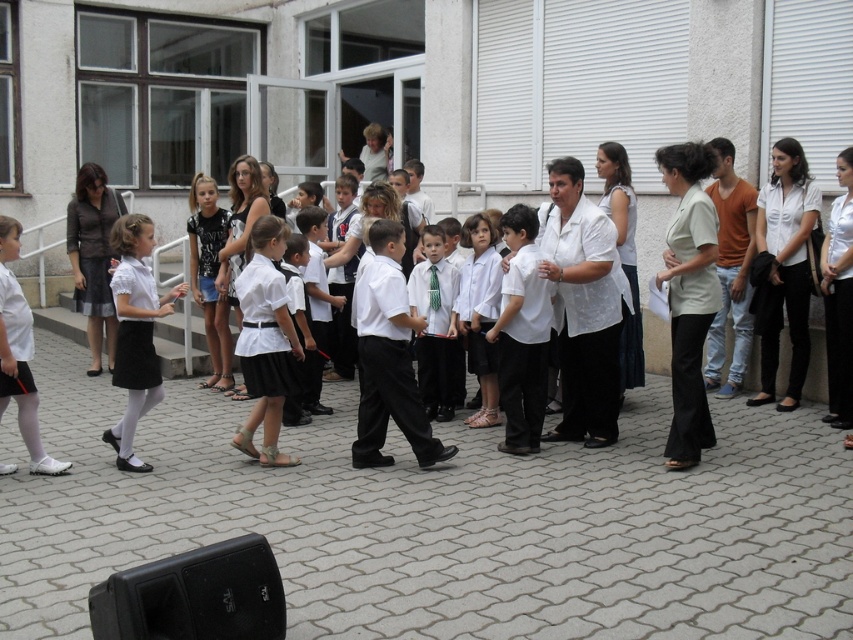
Is beige fabric blouse at center to the right of white matte skirt at center from the viewer's perspective?

Indeed, beige fabric blouse at center is positioned on the right side of white matte skirt at center.

Does beige fabric blouse at center have a larger size compared to white matte skirt at center?

Answer: Indeed, beige fabric blouse at center has a larger size compared to white matte skirt at center.

This screenshot has height=640, width=853. I want to click on beige fabric blouse at center, so click(688, 296).

Is beige fabric blouse at center thinner than matte white blouse at center?

Correct, beige fabric blouse at center's width is less than matte white blouse at center's.

Identify the location of beige fabric blouse at center. The width and height of the screenshot is (853, 640). (688, 296).

In the scene shown: Is matte white shirt at center in front of white cotton dress at center?

That is False.

Does matte white shirt at center have a smaller size compared to white cotton dress at center?

Actually, matte white shirt at center might be larger than white cotton dress at center.

Is point (439, 276) farther from viewer compared to point (154, 371)?

That is True.

Where is `matte white shirt at center`? The height and width of the screenshot is (640, 853). matte white shirt at center is located at coordinates (434, 324).